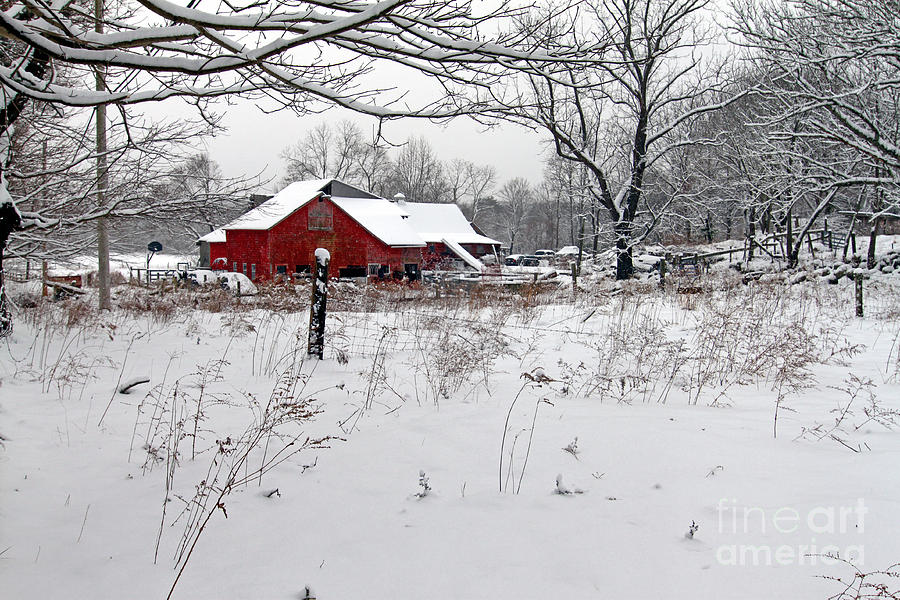
Find the location of a particular element. door is located at coordinates (x=416, y=268).